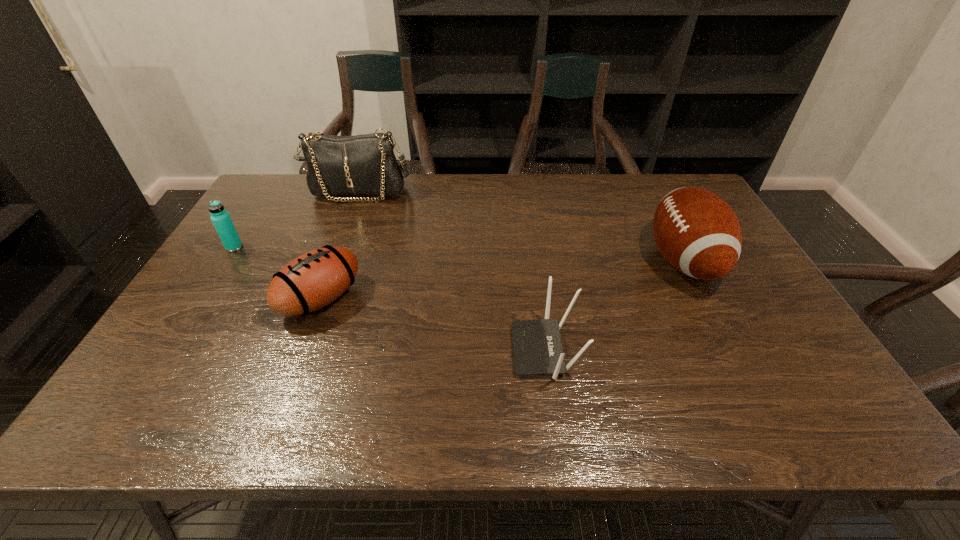
This screenshot has width=960, height=540. Find the location of `blank region between the rightmost object and the router`. blank region between the rightmost object and the router is located at coordinates (614, 306).

The image size is (960, 540). I want to click on empty space between the shorter football (American) and the router, so click(x=433, y=325).

Identify the location of vacant space in between the rightmost object and the fourth object from left to right. (614, 306).

Locate an element on the screen. free point between the second object from right to left and the rightmost object is located at coordinates (614, 306).

In order to click on free space between the left football (American) and the router in this screenshot , I will do `click(433, 325)`.

The width and height of the screenshot is (960, 540). What are the coordinates of `empty space between the rightmost object and the fourth object from left to right` in the screenshot? It's located at (614, 306).

Locate which object ranks second in proximity to the handbag. Please provide its 2D coordinates. Your answer should be formatted as a tuple, i.e. [(x, y)], where the tuple contains the x and y coordinates of a point satisfying the conditions above.

[(313, 280)]

Where is `object that can be found as the third closest to the second object from right to left`? object that can be found as the third closest to the second object from right to left is located at coordinates (362, 165).

Where is `free location that satisfies the following two spatial constraints: 1. at the front of the left football (American) with chain and zipper; 2. on the right side of the farthest object`? Image resolution: width=960 pixels, height=540 pixels. free location that satisfies the following two spatial constraints: 1. at the front of the left football (American) with chain and zipper; 2. on the right side of the farthest object is located at coordinates (320, 299).